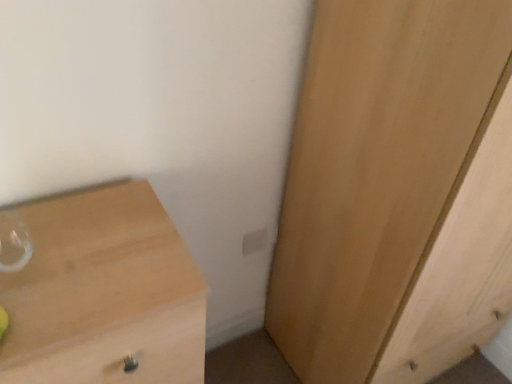
Question: Considering the positions of white plastic electric outlet at center and light wood chest of drawers at lower left in the image, is white plastic electric outlet at center bigger or smaller than light wood chest of drawers at lower left?

Choices:
 (A) small
 (B) big

Answer: (A)

Question: Considering the positions of point (259, 236) and point (176, 360), is point (259, 236) closer or farther from the camera than point (176, 360)?

Choices:
 (A) farther
 (B) closer

Answer: (A)

Question: Which object is positioned closest to the light wood cupboard at right?

Choices:
 (A) white plastic electric outlet at center
 (B) light wood chest of drawers at lower left

Answer: (A)

Question: Which object is the farthest from the light wood chest of drawers at lower left?

Choices:
 (A) light wood cupboard at right
 (B) white plastic electric outlet at center

Answer: (B)